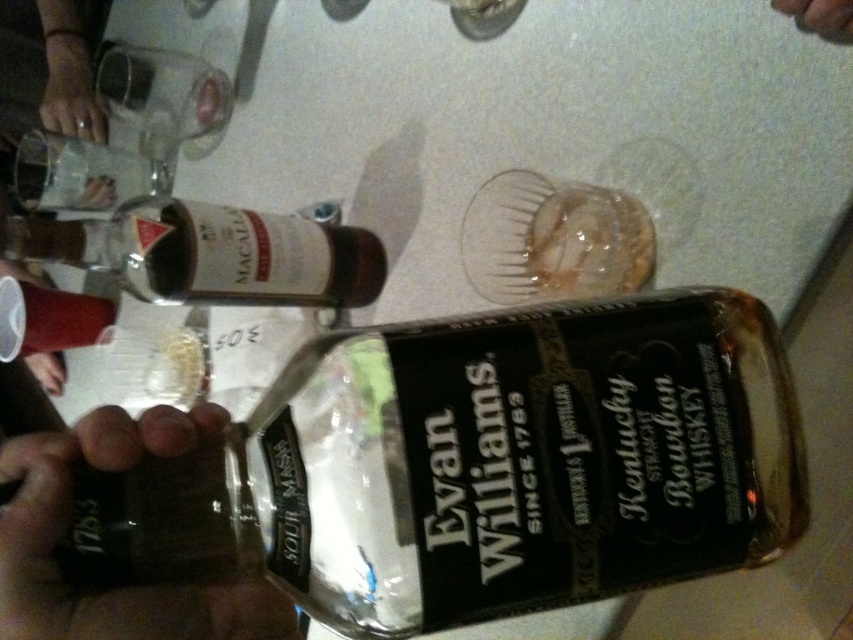
Question: Which object appears closest to the camera in this image?

Choices:
 (A) matte glass bottle at upper left
 (B) clear glass bottle at center
 (C) black matte bottle at lower left

Answer: (C)

Question: Is black matte bottle at lower left in front of matte plastic cup at lower left?

Choices:
 (A) yes
 (B) no

Answer: (A)

Question: Can you confirm if translucent plastic cup at lower left is smaller than matte plastic cup at lower left?

Choices:
 (A) yes
 (B) no

Answer: (A)

Question: Which object is positioned closest to the clear glass bottle at upper left?

Choices:
 (A) matte plastic cup at lower left
 (B) clear glass bottle at center
 (C) translucent plastic cup at lower left
 (D) matte glass bottle at upper left

Answer: (C)

Question: Among these points, which one is nearest to the camera?

Choices:
 (A) (41, 362)
 (B) (743, 476)

Answer: (B)

Question: Is black matte bottle at lower left closer to the viewer compared to matte glass bottle at upper left?

Choices:
 (A) no
 (B) yes

Answer: (B)